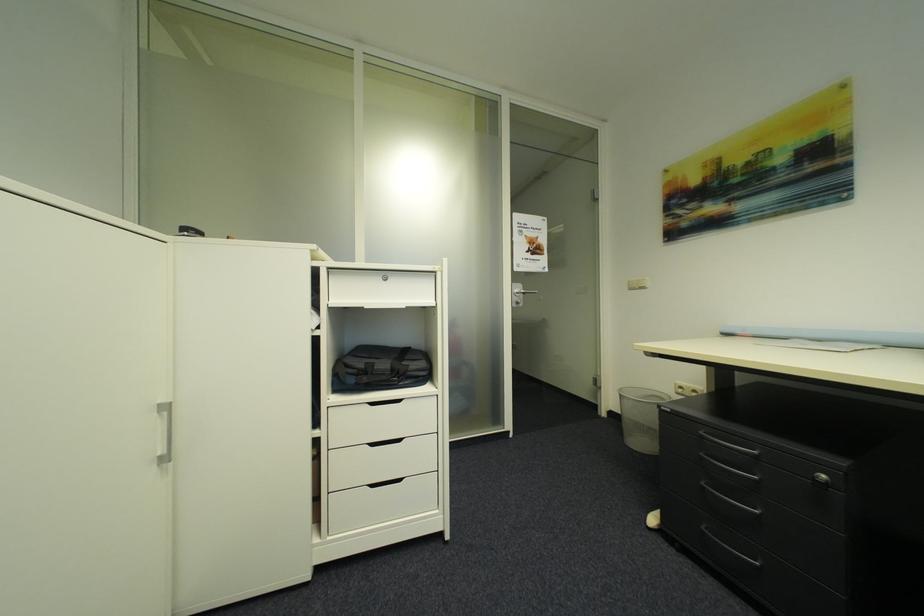
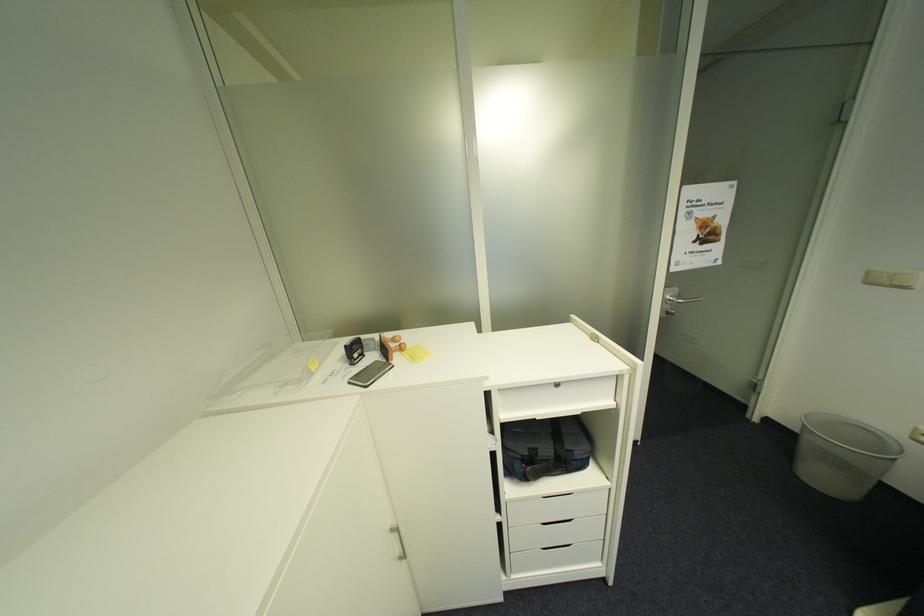
Find the pixel in the second image that matches (x=638, y=290) in the first image.

(876, 284)